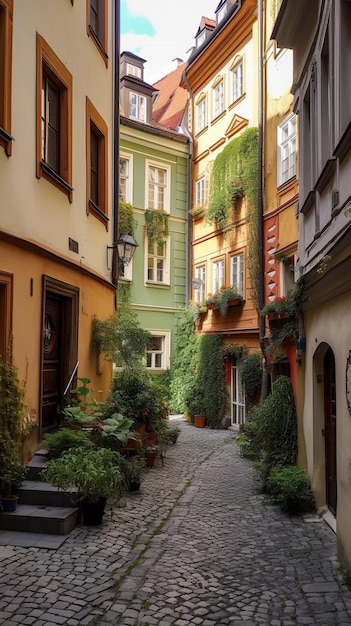
At what (x,y) coordinates should I click in order to perform the action: click on planter. Please return your answer as a coordinate pair (x, y). This screenshot has height=626, width=351. Looking at the image, I should click on (235, 295), (286, 314).